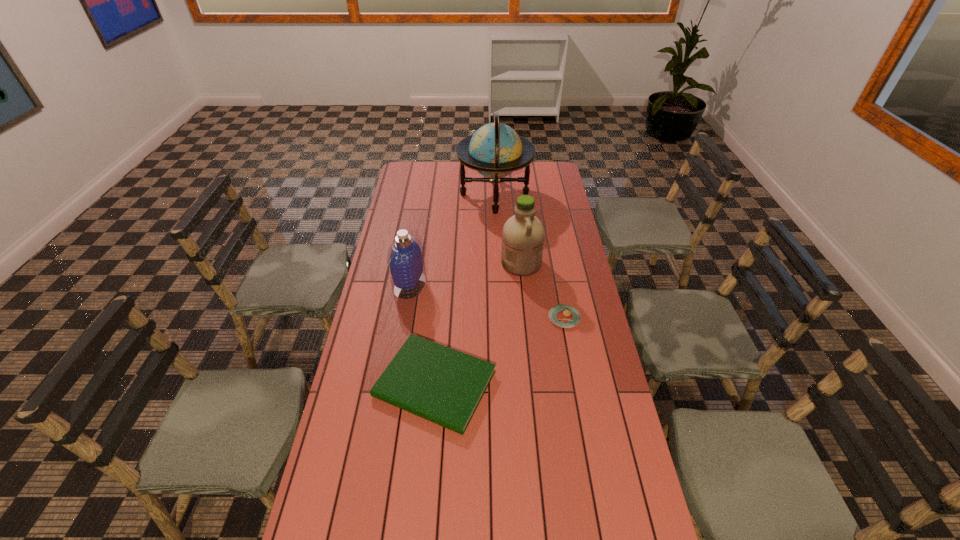
The height and width of the screenshot is (540, 960). I want to click on free spot located 0.290m on the surface of the farthest object, so click(400, 195).

Where is `blank space located on the front label of the taller cleansing agent`? This screenshot has width=960, height=540. blank space located on the front label of the taller cleansing agent is located at coordinates (451, 264).

You are a GUI agent. You are given a task and a screenshot of the screen. Output one action in this format:
    pyautogui.click(x=<x>, y=<y>)
    Task: Click on the free spot located 0.060m on the front label of the taller cleansing agent
    
    Given the screenshot: What is the action you would take?
    pyautogui.click(x=487, y=264)

I want to click on free space located on the front label of the taller cleansing agent, so click(468, 264).

Where is `vacant space situated 0.230m on the front of the third shortest object`? vacant space situated 0.230m on the front of the third shortest object is located at coordinates (399, 348).

Find the location of a particular element. This screenshot has height=540, width=960. free space located 0.170m on the back of the paperback book is located at coordinates 442,305.

Locate an element on the screen. The image size is (960, 540). free location located on the right of the pastry is located at coordinates (596, 318).

Identify the location of object that is at the far edge. (495, 150).

Where is `cleansing agent positioned at the left edge`? The width and height of the screenshot is (960, 540). cleansing agent positioned at the left edge is located at coordinates (405, 258).

The height and width of the screenshot is (540, 960). What are the coordinates of `paperback book that is at the left edge` in the screenshot? It's located at (445, 386).